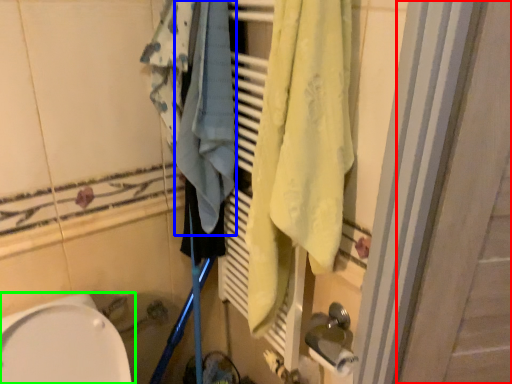
Question: Considering the real-world distances, which object is closest to screen door (highlighted by a red box)? bath towel (highlighted by a blue box) or toilet (highlighted by a green box).

Choices:
 (A) bath towel
 (B) toilet

Answer: (A)